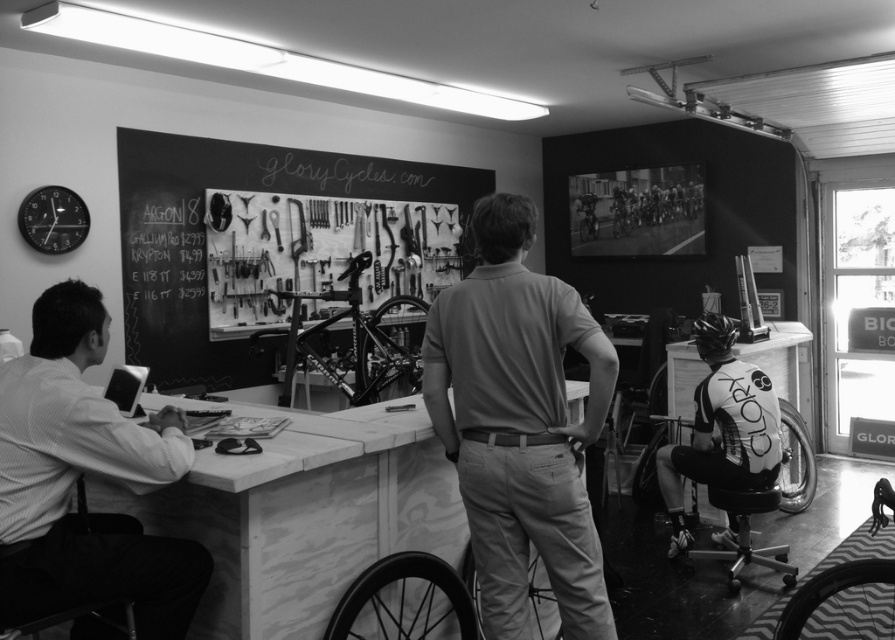
Question: Can you confirm if smooth beige polo shirt at center is smaller than white shirt at left?

Choices:
 (A) no
 (B) yes

Answer: (A)

Question: Does white shirt at left appear under chalkboard with tools at center?

Choices:
 (A) no
 (B) yes

Answer: (B)

Question: Does white shirt at left appear under white jersey at center?

Choices:
 (A) no
 (B) yes

Answer: (A)

Question: Which point is closer to the camera?

Choices:
 (A) chalkboard with tools at center
 (B) black plastic stool at lower right

Answer: (B)

Question: Which point is closer to the camera?

Choices:
 (A) (791, 570)
 (B) (666, 468)
 (C) (147, 234)

Answer: (A)

Question: Which of the following is the closest to the observer?

Choices:
 (A) black plastic stool at lower right
 (B) smooth beige polo shirt at center

Answer: (B)